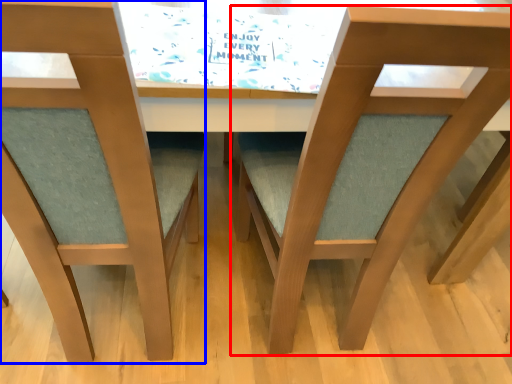
Question: Which point is further to the camera, chair (highlighted by a red box) or chair (highlighted by a blue box)?

Choices:
 (A) chair
 (B) chair

Answer: (A)